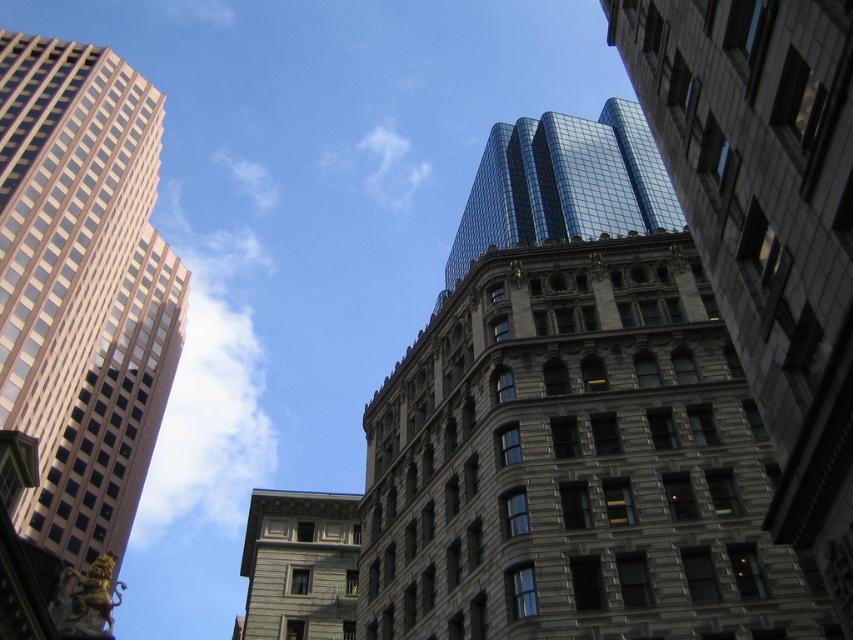
You are an architect analyzing the cityscape. You notice the shiny glass skyscraper at upper center and the gray stone building at center. Which building appears closer to you based on their spatial arrangement?

The shiny glass skyscraper at upper center appears closer because it is positioned in front of the gray stone building at center.

You are an architect analyzing the cityscape. You notice the matte glass skyscraper at left and the shiny glass skyscraper at upper center. Which of these two buildings is closer to your current position?

The matte glass skyscraper at left is closer to you because it is further to the viewer than the shiny glass skyscraper at upper center.

You are standing at the center of the city square and looking towards the historic building in the foreground. Which direction should you turn to face the matte glass skyscraper at left?

Since the matte glass skyscraper at left is positioned at point 0.450 on the x and 0.097 on the y, which is to the left side of the scene, you should turn to your left to face the matte glass skyscraper at left.